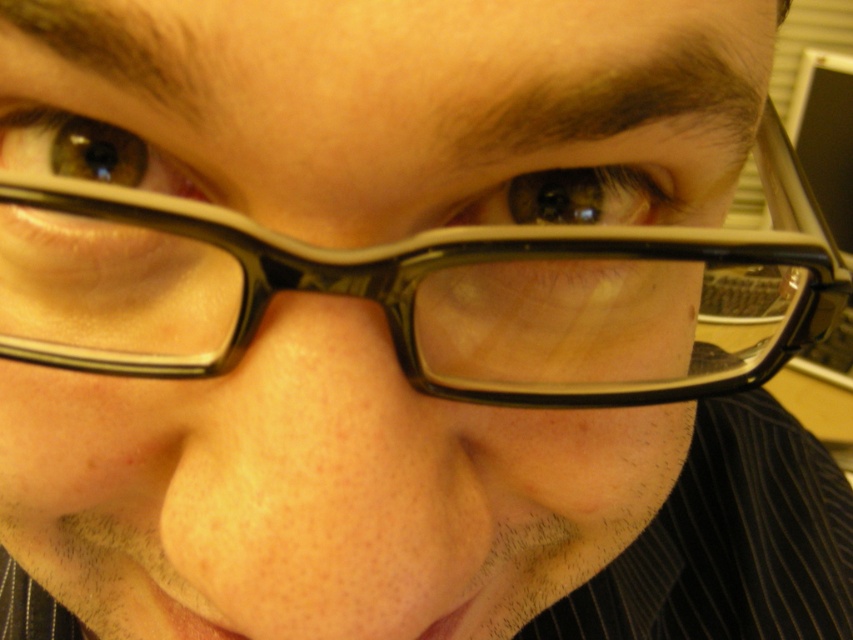
Is black plastic glasses at center to the left of matte black eye at center from the viewer's perspective?

Indeed, black plastic glasses at center is positioned on the left side of matte black eye at center.

Is black plastic glasses at center thinner than matte black eye at center?

No.

Is point (735, 358) closer to viewer compared to point (515, 208)?

No, it is behind (515, 208).

The height and width of the screenshot is (640, 853). I want to click on black plastic glasses at center, so click(x=425, y=292).

Measure the distance between matte black eye at center and matte black eye at upper left.

They are 3.47 inches apart.

Is matte black eye at center to the right of matte black eye at upper left from the viewer's perspective?

Indeed, matte black eye at center is positioned on the right side of matte black eye at upper left.

Is point (625, 170) closer to viewer compared to point (105, 179)?

No, it is behind (105, 179).

Identify the location of matte black eye at center. (567, 205).

Can you confirm if black plastic glasses at center is positioned to the left of matte black eye at upper left?

In fact, black plastic glasses at center is to the right of matte black eye at upper left.

Is point (532, 310) closer to camera compared to point (28, 141)?

That is False.

The width and height of the screenshot is (853, 640). I want to click on black plastic glasses at center, so click(425, 292).

Image resolution: width=853 pixels, height=640 pixels. In order to click on black plastic glasses at center in this screenshot , I will do (425, 292).